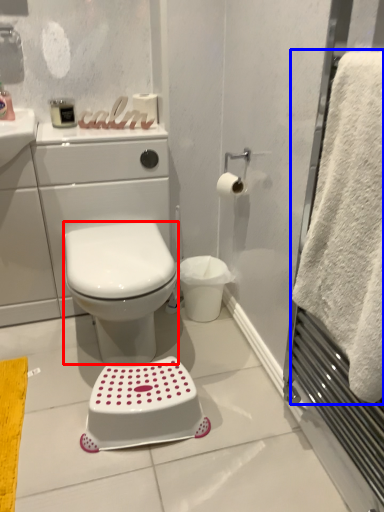
Question: Among these objects, which one is nearest to the camera, bidet (highlighted by a red box) or towel (highlighted by a blue box)?

Choices:
 (A) bidet
 (B) towel

Answer: (B)